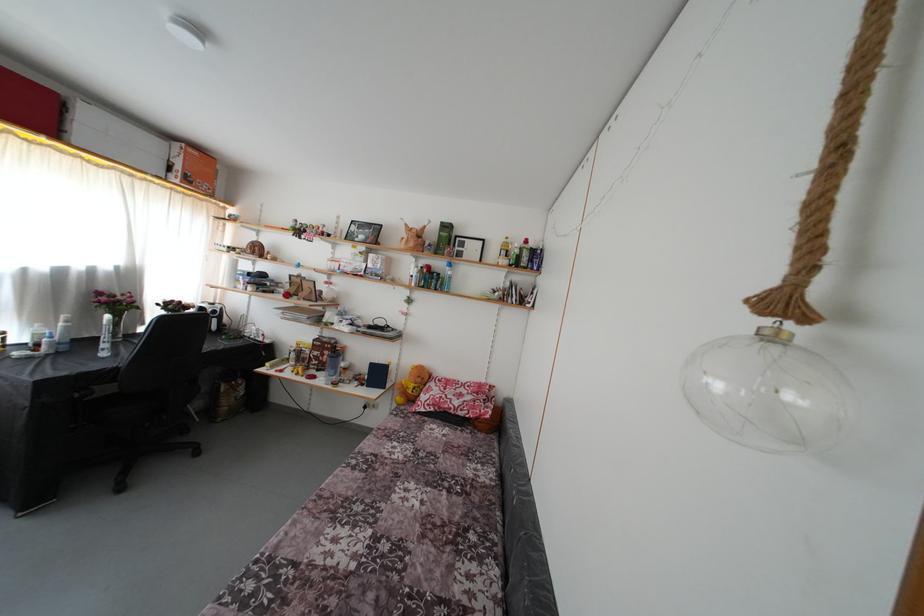
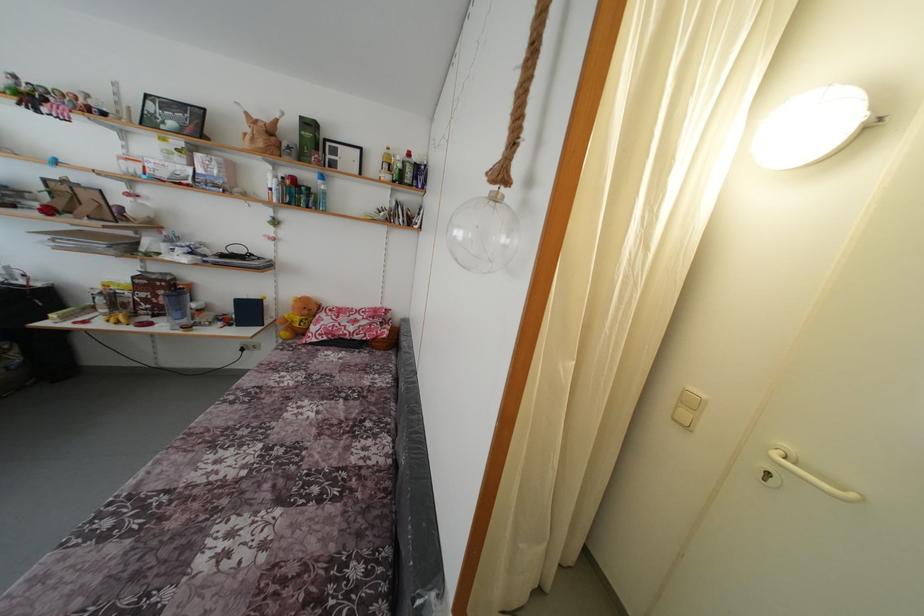
Find the pixel in the second image that matches point 424,386 in the first image.

(310, 317)